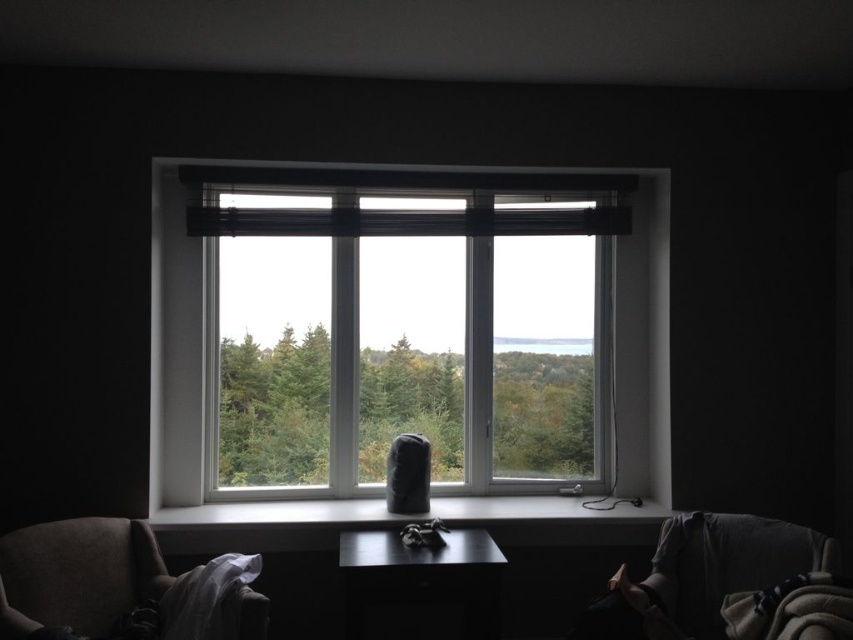
Question: Which point is closer to the camera?

Choices:
 (A) (531, 500)
 (B) (57, 577)
 (C) (560, 314)

Answer: (B)

Question: Does white plastic window at center appear over dark gray fabric armchair at lower left?

Choices:
 (A) no
 (B) yes

Answer: (B)

Question: Among these points, which one is farthest from the camera?

Choices:
 (A) (663, 506)
 (B) (184, 360)

Answer: (A)

Question: Which object is farther from the camera taking this photo?

Choices:
 (A) dark gray fabric armchair at lower left
 (B) white smooth window sill at center
 (C) white plastic window at center

Answer: (C)

Question: Is white plastic window at center closer to camera compared to white smooth window sill at center?

Choices:
 (A) no
 (B) yes

Answer: (A)

Question: Is white plastic window at center wider than dark gray fabric armchair at lower left?

Choices:
 (A) no
 (B) yes

Answer: (B)